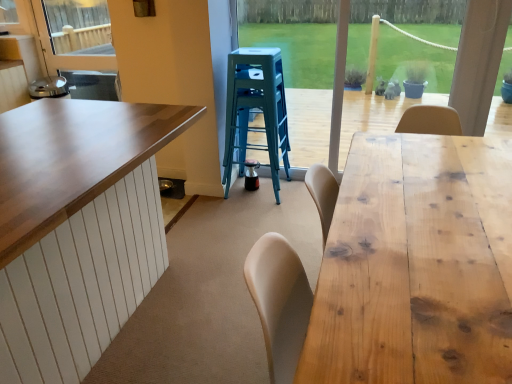
Identify the location of wooden frame at center. The height and width of the screenshot is (384, 512). point(295,37).

Would you say teal plastic stool at center is a long distance from wooden frame at center?

Yes, teal plastic stool at center and wooden frame at center are quite far apart.

From the image's perspective, which object appears higher, teal plastic stool at center or wooden frame at center?

wooden frame at center appears higher in the image.

What's the angular difference between teal plastic stool at center and wooden frame at center's facing directions?

The angle between the facing direction of teal plastic stool at center and the facing direction of wooden frame at center is 93.2 degrees.

Can you see natural wood table at right touching wooden frame at center?

natural wood table at right and wooden frame at center are not in contact.

Which object is closer to the camera taking this photo, natural wood table at right or wooden frame at center?

natural wood table at right is in front.

In the scene shown: Is natural wood table at right positioned with its back to wooden frame at center?

No.

From a real-world perspective, is natural wood table at right located beneath wooden frame at center?

Yes, from a real-world perspective, natural wood table at right is below wooden frame at center.

In the scene shown: Considering the relative positions of wooden frame at center and natural wood table at right in the image provided, is wooden frame at center to the left of natural wood table at right from the viewer's perspective?

Yes, wooden frame at center is to the left of natural wood table at right.

Looking at their sizes, would you say wooden frame at center is wider or thinner than natural wood table at right?

Clearly, wooden frame at center has less width compared to natural wood table at right.

Considering the positions of objects wooden frame at center and natural wood table at right in the image provided, who is in front, wooden frame at center or natural wood table at right?

natural wood table at right is closer to the camera.

Would you say natural wood table at right is a long distance from teal plastic stool at center?

natural wood table at right is positioned a significant distance from teal plastic stool at center.

Which is less distant, (426,325) or (279,52)?

Point (426,325) is closer to the camera than point (279,52).

Could you tell me if natural wood table at right is facing teal plastic stool at center?

No, natural wood table at right is not oriented towards teal plastic stool at center.

From the image's perspective, does wooden frame at center appear lower than teal plastic stool at center?

No, from the image's perspective, wooden frame at center is not below teal plastic stool at center.

Is wooden frame at center oriented towards teal plastic stool at center?

Yes, wooden frame at center is aimed at teal plastic stool at center.

Locate an element on the screen. window frame above the teal plastic stool at center (from a real-world perspective) is located at coordinates (295, 37).

Is wooden frame at center completely or partially outside of teal plastic stool at center?

wooden frame at center lies outside teal plastic stool at center's area.

From the image's perspective, is teal plastic stool at center above or below natural wood table at right?

Clearly, from the image's perspective, teal plastic stool at center is above natural wood table at right.

Relative to natural wood table at right, is teal plastic stool at center in front or behind?

Visually, teal plastic stool at center is located behind natural wood table at right.

From a real-world perspective, which object stands above the other?

teal plastic stool at center is physically above.

How different are the orientations of teal plastic stool at center and natural wood table at right in degrees?

The facing directions of teal plastic stool at center and natural wood table at right are 177 degrees apart.

You are a GUI agent. You are given a task and a screenshot of the screen. Output one action in this format:
    pyautogui.click(x=<x>, y=<y>)
    Task: Click on the window frame located above the teal plastic stool at center (from the image's perspective)
    This screenshot has height=384, width=512.
    Given the screenshot: What is the action you would take?
    pyautogui.click(x=295, y=37)

At what (x,y) coordinates should I click in order to perform the action: click on table lying in front of the wooden frame at center. Please return your answer as a coordinate pair (x, y). The image size is (512, 384). Looking at the image, I should click on (416, 265).

Which object lies further to the anchor point wooden frame at center, teal plastic stool at center or natural wood table at right?

Among the two, natural wood table at right is located further to wooden frame at center.

Estimate the real-world distances between objects in this image. Which object is further from teal plastic stool at center, natural wood table at right or wooden frame at center?

wooden frame at center is further to teal plastic stool at center.

Which object lies nearer to the anchor point natural wood table at right, wooden frame at center or teal plastic stool at center?

teal plastic stool at center lies closer to natural wood table at right than the other object.

Based on their spatial positions, is wooden frame at center or natural wood table at right closer to teal plastic stool at center?

Based on the image, natural wood table at right appears to be nearer to teal plastic stool at center.

Considering their positions, is natural wood table at right positioned closer to wooden frame at center than teal plastic stool at center?

teal plastic stool at center.

Which object lies further to the anchor point natural wood table at right, teal plastic stool at center or wooden frame at center?

wooden frame at center is positioned further to the anchor natural wood table at right.

Where is `window frame between natural wood table at right and teal plastic stool at center in the front-back direction`? This screenshot has height=384, width=512. window frame between natural wood table at right and teal plastic stool at center in the front-back direction is located at coordinates (295, 37).